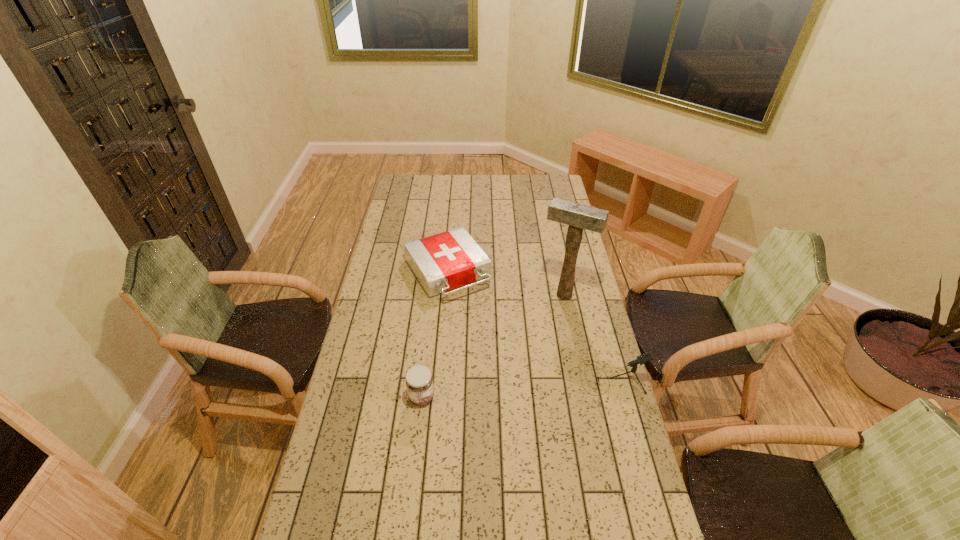
What are the coordinates of `vacant spot on the desktop that is between the jam and the microphone and is positioned on the front side of the first-aid kit` in the screenshot? It's located at (528, 386).

Locate an element on the screen. vacant space on the desktop that is between the jam and the microphone and is positioned on the striking surface of the mallet is located at coordinates (519, 387).